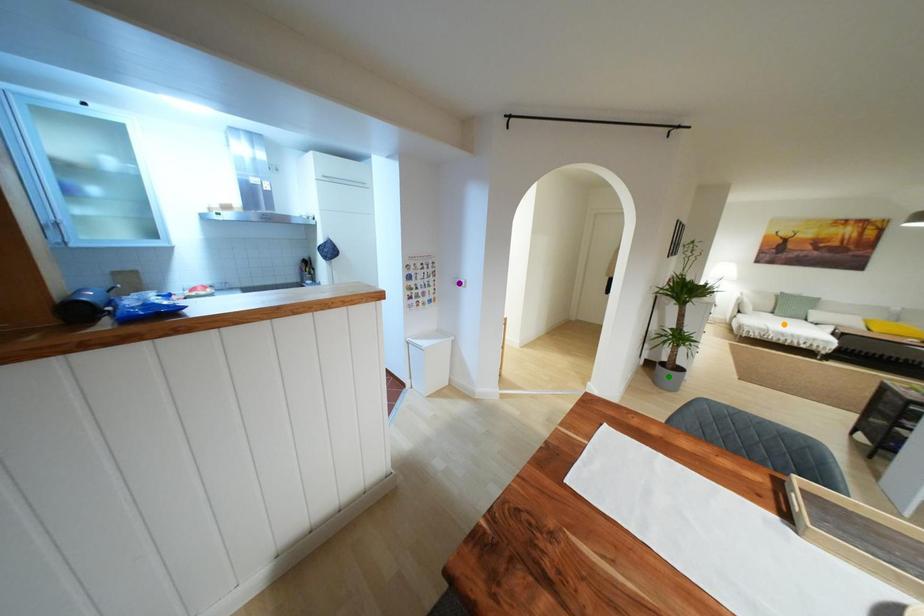
Consider the image. Order these from farthest to nearest:
green point | purple point | orange point

orange point
green point
purple point